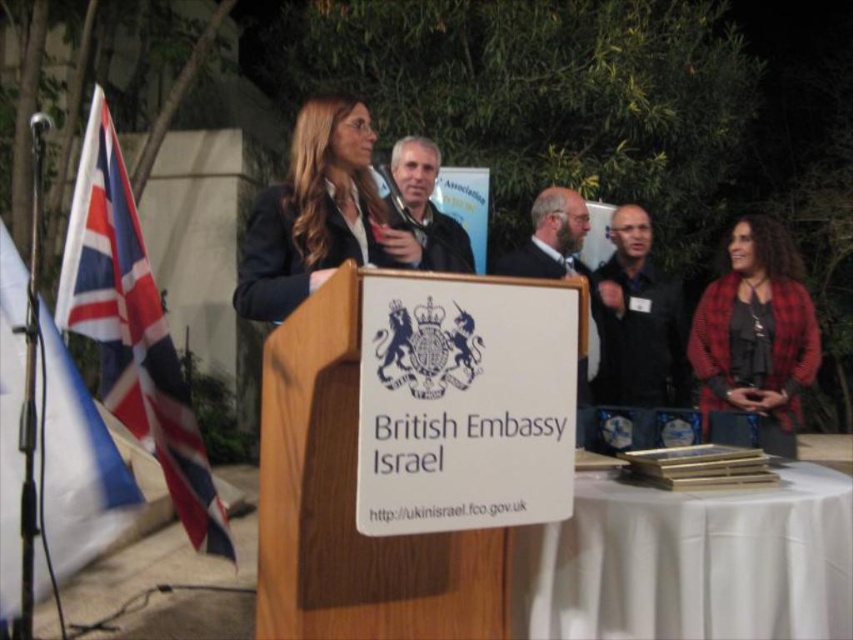
Does point (9, 490) lie in front of point (526, 259)?

Yes.

Does red and blue fabric flag at left have a greater height compared to dark suit at center?

Correct, red and blue fabric flag at left is much taller as dark suit at center.

Who is more distant from viewer, (1,540) or (532,211)?

Positioned behind is point (532,211).

The image size is (853, 640). I want to click on red and blue fabric flag at left, so click(x=77, y=464).

Is red and blue fabric flag at left closer to the viewer compared to red plaid shirt at right?

Yes, red and blue fabric flag at left is closer to the viewer.

Between red and blue fabric flag at left and red plaid shirt at right, which one appears on the right side from the viewer's perspective?

red plaid shirt at right

Who is more forward, [16,548] or [790,369]?

Point [16,548] is in front.

Locate an element on the screen. Image resolution: width=853 pixels, height=640 pixels. red and blue fabric flag at left is located at coordinates (77, 464).

Is black leather jacket at center shorter than matte black jacket at center?

No, black leather jacket at center is not shorter than matte black jacket at center.

In the scene shown: Is black leather jacket at center positioned in front of matte black jacket at center?

No, it is not.

Identify the location of black leather jacket at center. (637, 321).

At what (x,y) coordinates should I click in order to perform the action: click on black leather jacket at center. Please return your answer as a coordinate pair (x, y). The height and width of the screenshot is (640, 853). Looking at the image, I should click on (637, 321).